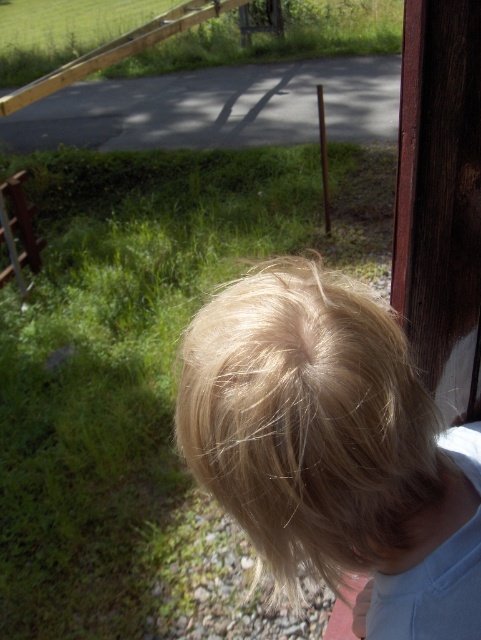
You are a photographer trying to capture a shot of the blonde hair at upper right and the brushed metal fence at left. Based on the scene description, which object is closer to the camera?

The blonde hair at upper right is positioned under the brushed metal fence at left, meaning the fence is closer to the camera than the hair.

You are a photographer trying to capture a shot of the blonde hair at upper right and the brushed metal fence at left. Based on their positions, which object should you focus on first to ensure both are in sharp focus?

The blonde hair at upper right is closer to the viewer than the brushed metal fence at left. To ensure both are in sharp focus, focus on the closer object first, which is the blonde hair at upper right.

You are standing behind the person in the image and want to touch their hair. If you move forward along the direction you are facing, will you reach the point where the blonde hair is located at point (316, 426) before reaching the paved path?

The blonde hair at upper right is located at point (316, 426), so yes, you will reach the point where the blonde hair is located before reaching the paved path since the paved path is further away from your current position.